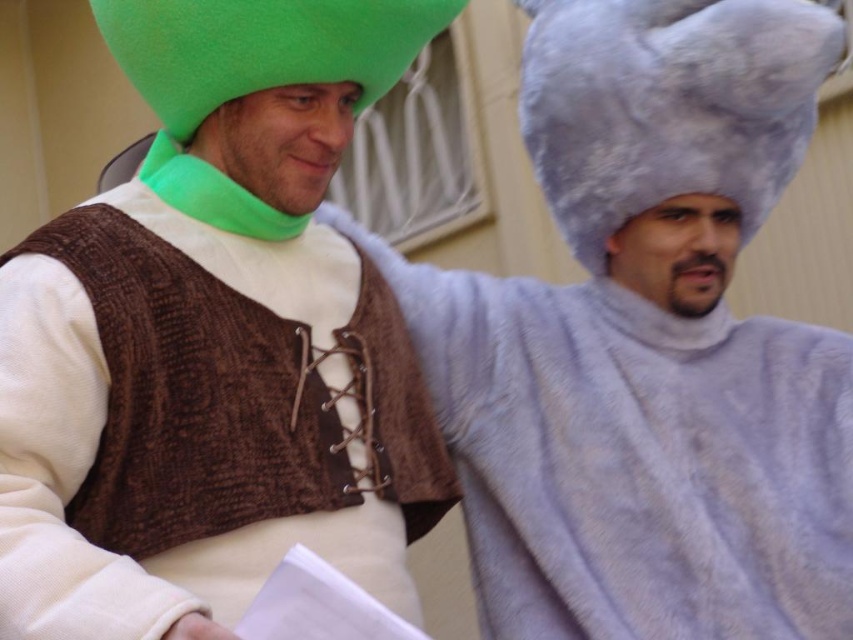
Is matte green hat at upper left below fuzzy gray hat at right?

No, matte green hat at upper left is not below fuzzy gray hat at right.

Does matte green hat at upper left have a greater width compared to fuzzy gray hat at right?

Incorrect, matte green hat at upper left's width does not surpass fuzzy gray hat at right's.

Which is in front, point (102, 248) or point (509, 516)?

Point (102, 248) is in front.

Locate an element on the screen. matte green hat at upper left is located at coordinates (213, 340).